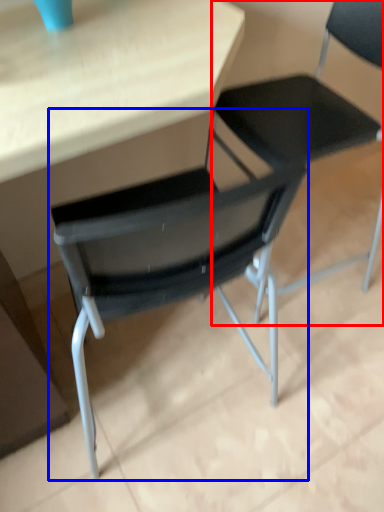
Question: Which object appears closest to the camera in this image, chair (highlighted by a red box) or chair (highlighted by a blue box)?

Choices:
 (A) chair
 (B) chair

Answer: (A)